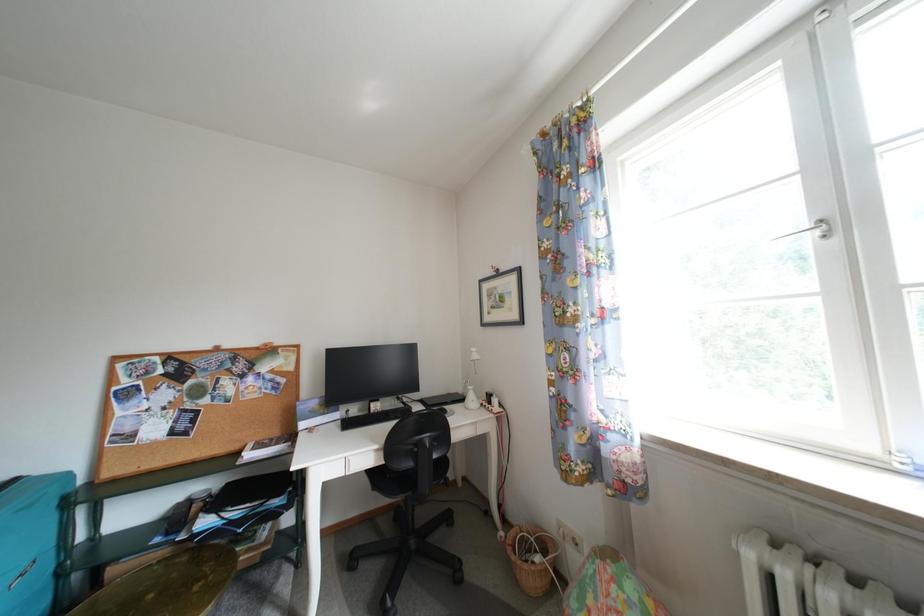
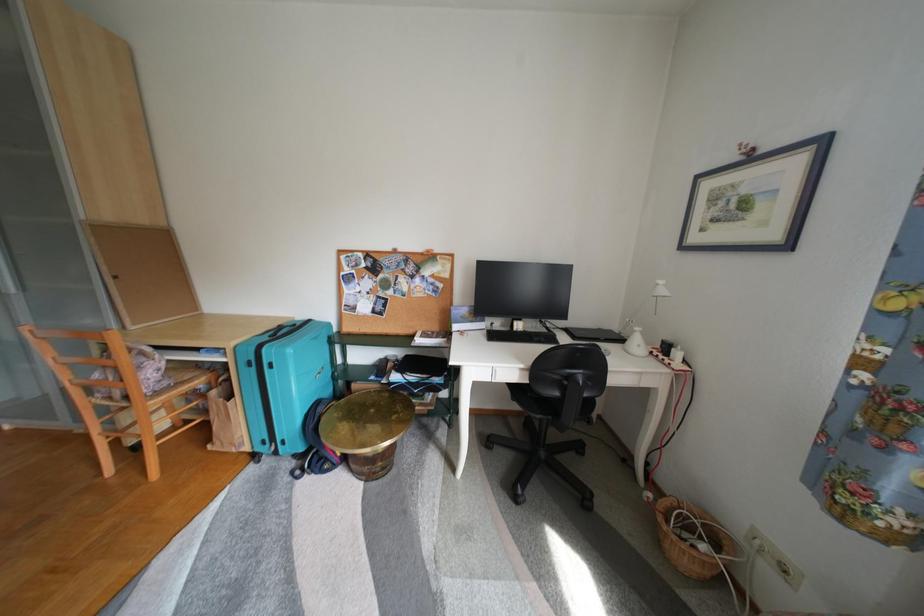
The images are taken continuously from a first-person perspective. In which direction is your viewpoint rotating?

The rotation direction of the camera is left-down.